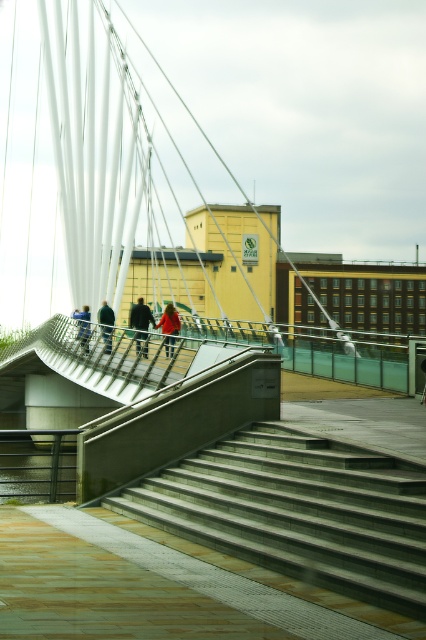
Question: Which of the following is the farthest from the observer?

Choices:
 (A) (176, 333)
 (B) (353, 572)
 (C) (100, 330)
 (D) (132, 317)

Answer: (D)

Question: Which point appears closest to the camera in this image?

Choices:
 (A) (104, 337)
 (B) (146, 316)
 (C) (386, 492)
 (D) (81, 310)

Answer: (C)

Question: Considering the relative positions of dark green jacket at center and blue fabric jacket at center in the image provided, where is dark green jacket at center located with respect to blue fabric jacket at center?

Choices:
 (A) above
 (B) below

Answer: (A)

Question: Can you confirm if dark green jacket at center is positioned to the right of blue fabric jacket at center?

Choices:
 (A) no
 (B) yes

Answer: (B)

Question: Which of these objects is positioned farthest from the red fabric coat at center?

Choices:
 (A) blue fabric jacket at center
 (B) dark green jacket at center
 (C) dark gray jacket at center

Answer: (A)

Question: Does gray concrete stairs at center lie behind red fabric coat at center?

Choices:
 (A) no
 (B) yes

Answer: (A)